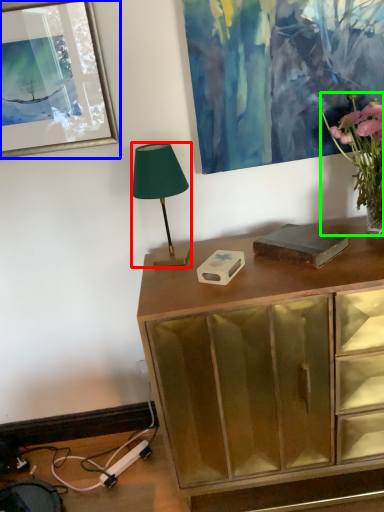
Question: Which is nearer to the lamp (highlighted by a red box)? picture frame (highlighted by a blue box) or houseplant (highlighted by a green box).

Choices:
 (A) picture frame
 (B) houseplant

Answer: (A)